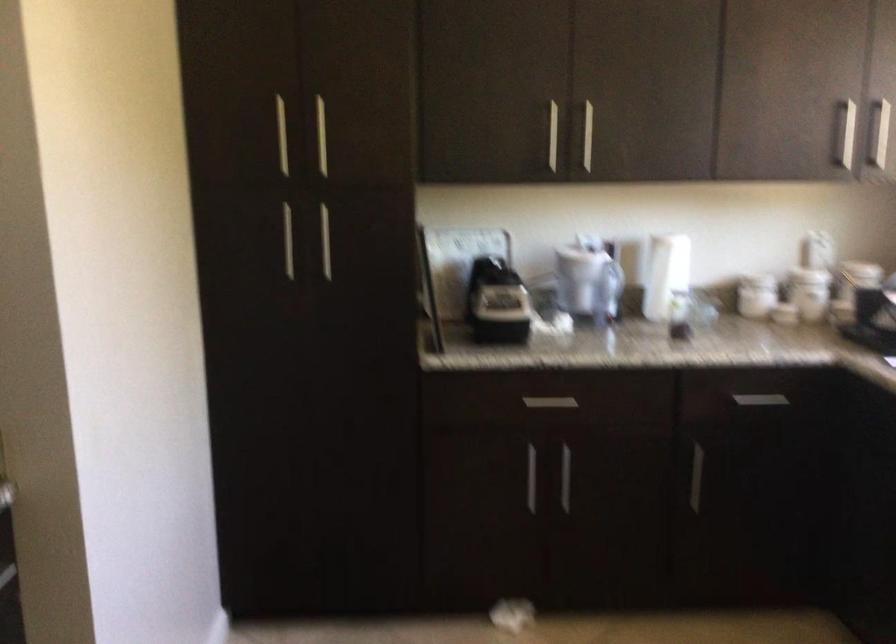
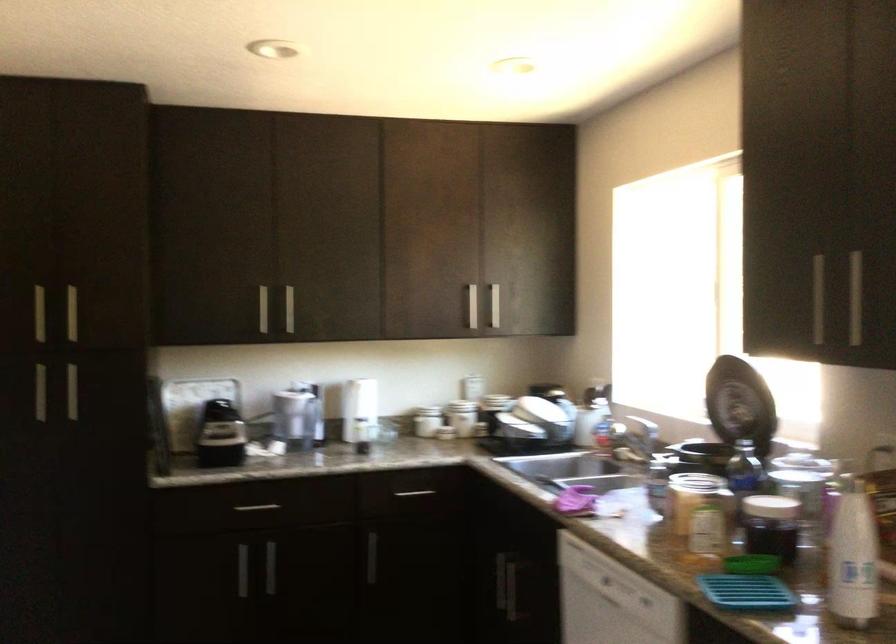
Where in the second image is the point corresponding to [496,303] from the first image?

(220, 435)